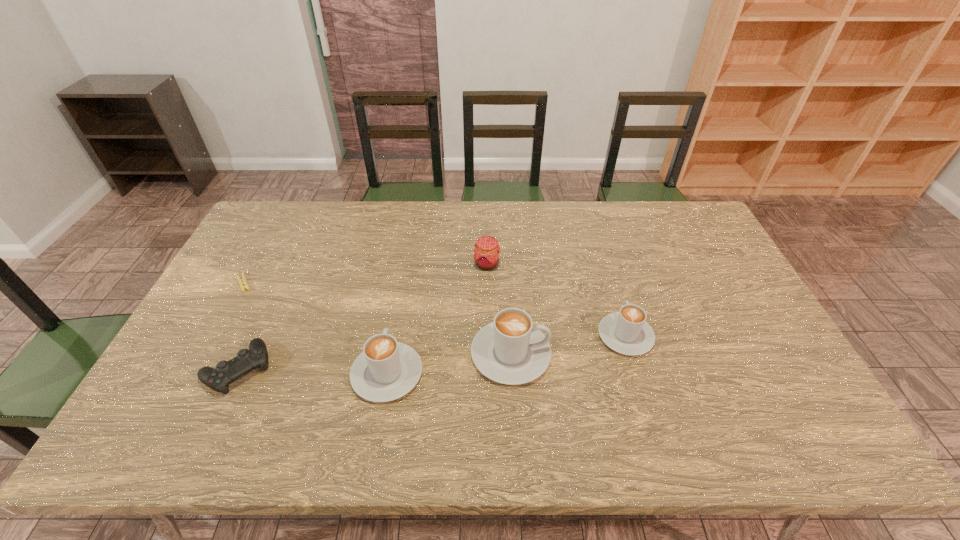
This screenshot has height=540, width=960. What are the coordinates of `free space for a new cappuccino on the right` in the screenshot? It's located at (732, 319).